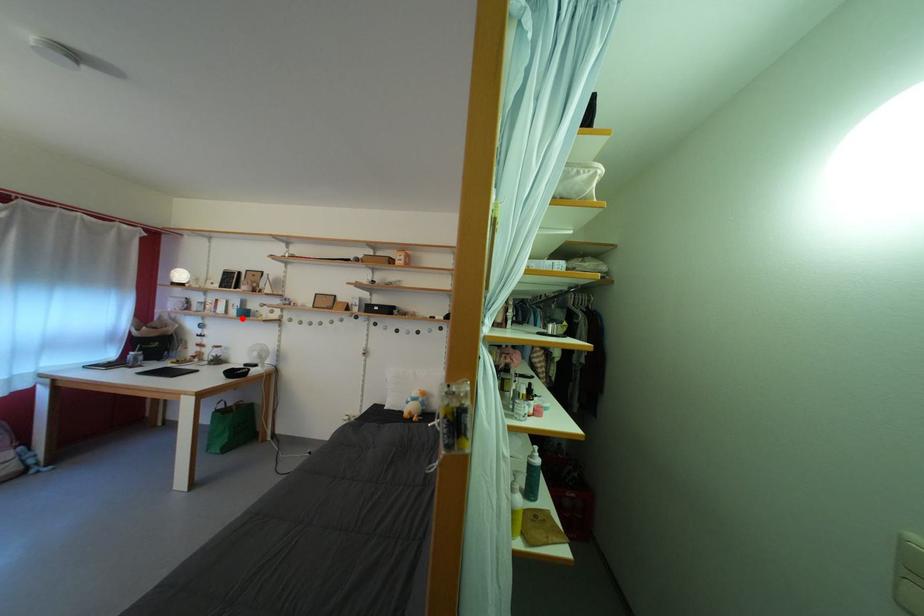
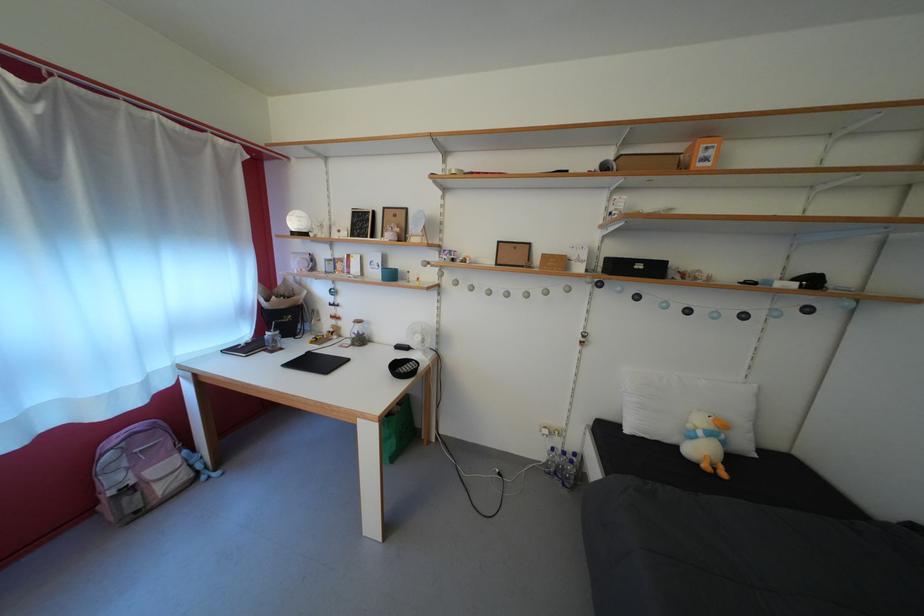
The point at the highlighted location is marked in the first image. Where is the corresponding point in the second image?

(383, 280)